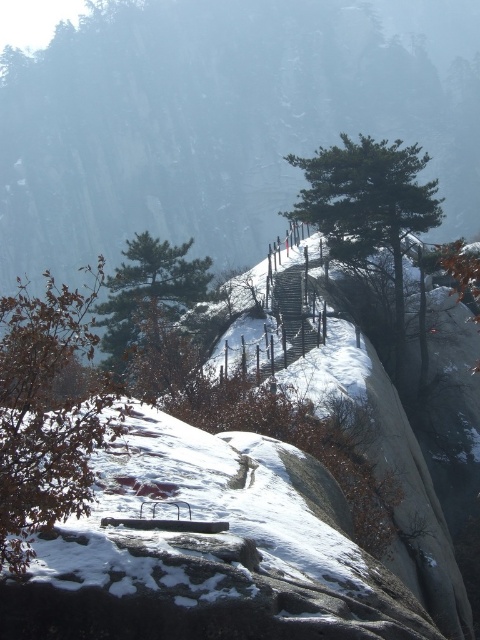
You are a hiker planning to take a photo of both the brown matte tree at lower left and the green matte tree at center. Which tree should you stand closer to in order to fit both in your camera frame?

To fit both the brown matte tree at lower left and the green matte tree at center in your camera frame, you should stand closer to the green matte tree at center because it is smaller than the brown matte tree at lower left.

You are a hiker planning to take a photo of the brown matte tree at lower left and the green matte tree at upper center. Which tree is closer to the camera, and which one is farther away?

The brown matte tree at lower left is positioned under the green matte tree at upper center, so the brown matte tree at lower left is closer to the camera, while the green matte tree at upper center is farther away.